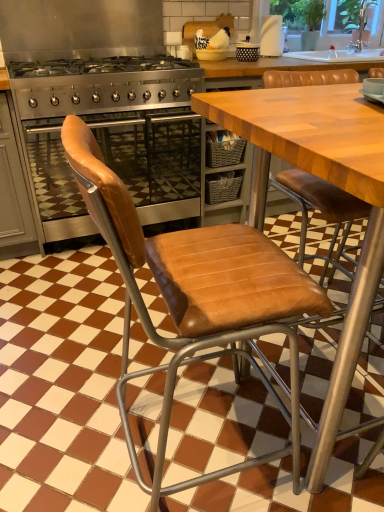
Identify the location of satin silver oven at left. The height and width of the screenshot is (512, 384). (14, 191).

Consider the image. What is the approximate height of brown leather chair at left?

The height of brown leather chair at left is 38.97 inches.

Where is `satin silver oven at left`? Image resolution: width=384 pixels, height=512 pixels. satin silver oven at left is located at coordinates (14, 191).

Identify the location of cabinetry above the brown leather chair at left (from the image's perspective). This screenshot has width=384, height=512. (14, 191).

Considering the positions of points (17, 155) and (69, 139), is point (17, 155) farther from camera compared to point (69, 139)?

Yes.

Looking at their sizes, would you say satin silver oven at left is wider or thinner than brown leather chair at left?

satin silver oven at left is wider than brown leather chair at left.

In the scene shown: Can you confirm if satin silver oven at left is shorter than brown leather chair at left?

Yes.

From a real-world perspective, relative to transparent glass window screen at upper right, is white matte paper towel at upper right vertically above or below?

white matte paper towel at upper right is below transparent glass window screen at upper right.

Consider the image. Is white matte paper towel at upper right oriented towards transparent glass window screen at upper right?

No, white matte paper towel at upper right does not turn towards transparent glass window screen at upper right.

Would you say white matte paper towel at upper right is inside or outside transparent glass window screen at upper right?

white matte paper towel at upper right is not enclosed by transparent glass window screen at upper right.

From a real-world perspective, between stainless steel oven at left and white matte paper towel at upper right, who is vertically lower?

stainless steel oven at left, from a real-world perspective.

In the image, is stainless steel oven at left on the left side or the right side of white matte paper towel at upper right?

From the image, it's evident that stainless steel oven at left is to the left of white matte paper towel at upper right.

Is white matte paper towel at upper right completely or partially inside stainless steel oven at left?

No, white matte paper towel at upper right is not inside stainless steel oven at left.

Who is more distant, stainless steel oven at left or white matte paper towel at upper right?

white matte paper towel at upper right.

Considering the relative sizes of transparent glass window screen at upper right and stainless steel gas stove at center in the image provided, is transparent glass window screen at upper right thinner than stainless steel gas stove at center?

Indeed, transparent glass window screen at upper right has a lesser width compared to stainless steel gas stove at center.

Is transparent glass window screen at upper right positioned in front of stainless steel gas stove at center?

No, transparent glass window screen at upper right is further to the viewer.

Can you confirm if transparent glass window screen at upper right is shorter than stainless steel gas stove at center?

Yes.

Would you say transparent glass window screen at upper right is inside or outside stainless steel gas stove at center?

transparent glass window screen at upper right cannot be found inside stainless steel gas stove at center.

Is point (273, 34) in front of point (243, 227)?

No, (273, 34) is further to viewer.

Could you tell me if white matte paper towel at upper right is turned towards brown leather chair at left?

No.

Is white matte paper towel at upper right next to brown leather chair at left and touching it?

No, white matte paper towel at upper right is not touching brown leather chair at left.

From the image's perspective, who appears lower, white matte paper towel at upper right or brown leather chair at left?

brown leather chair at left is shown below in the image.

In terms of width, does stainless steel gas stove at center look wider or thinner when compared to transparent glass window screen at upper right?

In the image, stainless steel gas stove at center appears to be wider than transparent glass window screen at upper right.

From a real-world perspective, is stainless steel gas stove at center beneath transparent glass window screen at upper right?

Correct, in the physical world, stainless steel gas stove at center is lower than transparent glass window screen at upper right.

Based on their sizes in the image, would you say stainless steel gas stove at center is bigger or smaller than transparent glass window screen at upper right?

stainless steel gas stove at center is bigger than transparent glass window screen at upper right.

Is transparent glass window screen at upper right placed right next to brown leather chair at left?

No, transparent glass window screen at upper right is not beside brown leather chair at left.

Does transparent glass window screen at upper right have a greater height compared to brown leather chair at left?

No.

Is transparent glass window screen at upper right oriented towards brown leather chair at left?

No, transparent glass window screen at upper right is not facing towards brown leather chair at left.

What are the coordinates of `chair below the satin silver oven at left (from a real-world perspective)` in the screenshot? It's located at (197, 297).

Identify the location of window screen located above the white matte paper towel at upper right (from the image's perspective). (344, 16).

Based on their spatial positions, is white matte paper towel at upper right or brown leather chair at left closer to transparent glass window screen at upper right?

The object closer to transparent glass window screen at upper right is white matte paper towel at upper right.

Looking at the image, which one is located further to satin silver oven at left, stainless steel oven at left or transparent glass window screen at upper right?

Among the two, transparent glass window screen at upper right is located further to satin silver oven at left.

When comparing their distances from brown leather chair at left, does stainless steel gas stove at center or stainless steel oven at left seem further?

stainless steel gas stove at center lies further to brown leather chair at left than the other object.

Considering their positions, is brown leather chair at left positioned closer to white matte paper towel at upper right than stainless steel gas stove at center?

stainless steel gas stove at center.

Based on their spatial positions, is brown leather chair at left or transparent glass window screen at upper right further from stainless steel gas stove at center?

Among the two, transparent glass window screen at upper right is located further to stainless steel gas stove at center.

In the scene shown: Considering their positions, is white matte paper towel at upper right positioned closer to satin silver oven at left than stainless steel gas stove at center?

The object closer to satin silver oven at left is stainless steel gas stove at center.

Estimate the real-world distances between objects in this image. Which object is further from brown leather chair at left, stainless steel gas stove at center or satin silver oven at left?

stainless steel gas stove at center.

When comparing their distances from satin silver oven at left, does brown leather chair at left or stainless steel gas stove at center seem further?

The object further to satin silver oven at left is brown leather chair at left.

You are a GUI agent. You are given a task and a screenshot of the screen. Output one action in this format:
    pyautogui.click(x=<x>, y=<y>)
    Task: Click on the kitchen appliance positioned between brown leather chair at left and transparent glass window screen at upper right from near to far
    Image resolution: width=384 pixels, height=512 pixels.
    Given the screenshot: What is the action you would take?
    pyautogui.click(x=112, y=134)

Locate an element on the screen. This screenshot has height=512, width=384. paper towel between satin silver oven at left and transparent glass window screen at upper right in the horizontal direction is located at coordinates (271, 36).

Where is `kitchen appliance located between satin silver oven at left and transparent glass window screen at upper right in the left-right direction`? kitchen appliance located between satin silver oven at left and transparent glass window screen at upper right in the left-right direction is located at coordinates (112, 134).

The image size is (384, 512). What are the coordinates of `gas stove between brown leather chair at left and stainless steel oven at left from front to back` in the screenshot? It's located at (103, 85).